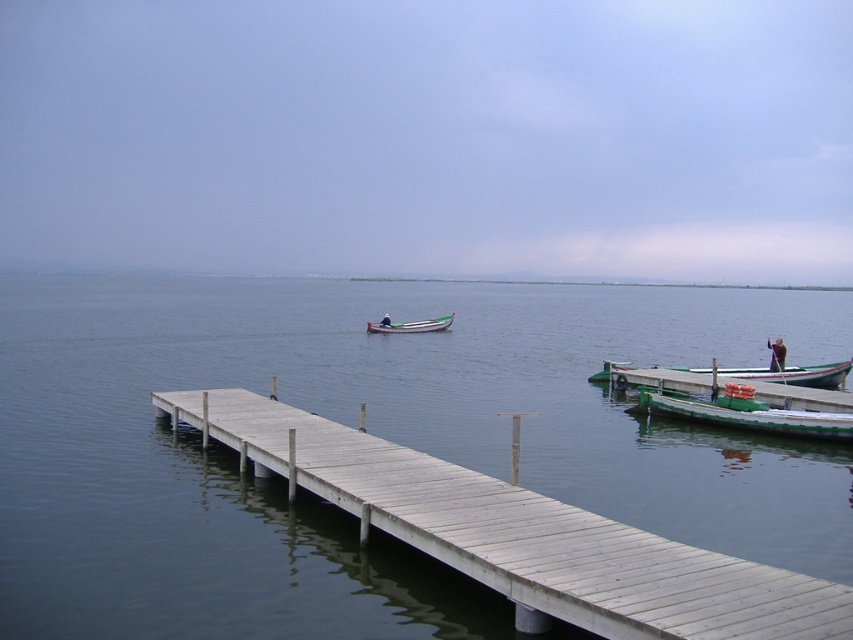
You are standing on the wooden dock and want to board the green wooden boat at right and the green wooden boat at center. Which boat is closer to you?

The green wooden boat at right is closer to you because it is positioned in front of the green wooden boat at center.

You are planning to store both the green matte boat at lower right and the green wooden boat at center in a storage shed. The shed has a width of 5 meters. Can both boats fit side by side inside the shed?

The green matte boat at lower right is larger in size than the green wooden boat at center. However, without specific measurements of their widths, it is impossible to determine if they can fit side by side in a 5 meter wide shed.